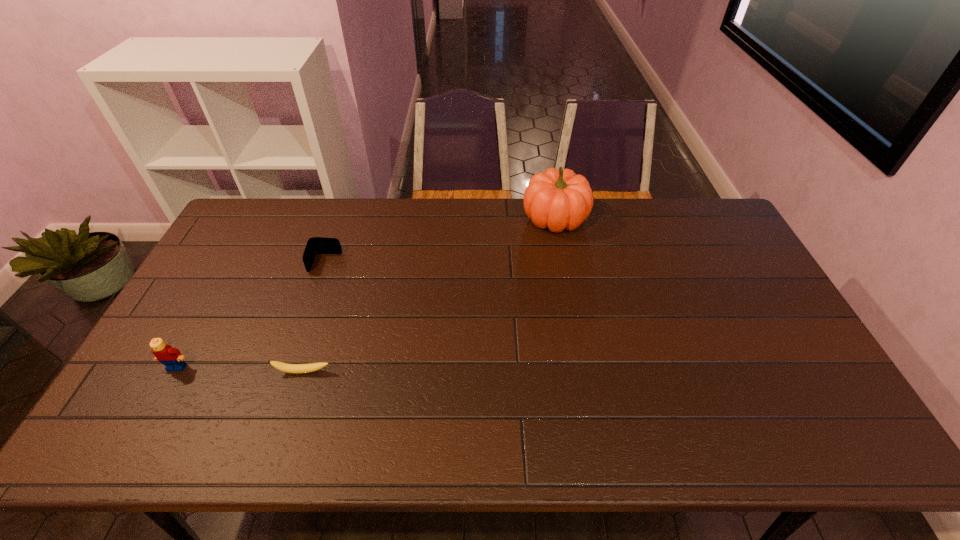
Locate an element on the screen. The image size is (960, 540). vacant space located on the upward curve of the shortest object is located at coordinates (285, 427).

Where is `object that is at the far edge`? object that is at the far edge is located at coordinates (559, 200).

Identify the location of object present at the left edge. The height and width of the screenshot is (540, 960). (171, 357).

You are a GUI agent. You are given a task and a screenshot of the screen. Output one action in this format:
    pyautogui.click(x=<x>, y=<y>)
    Task: Click on the vacant area at the far edge
    
    Given the screenshot: What is the action you would take?
    [x=420, y=231]

Where is `free region at the near edge of the desktop`? The image size is (960, 540). free region at the near edge of the desktop is located at coordinates (469, 432).

The image size is (960, 540). In the image, there is a desktop. Find the location of `free space at the left edge`. free space at the left edge is located at coordinates (164, 411).

Where is `vacant space at the right edge`? This screenshot has width=960, height=540. vacant space at the right edge is located at coordinates (798, 379).

Identify the location of vacant space in between the wallet and the farthest object. (440, 241).

Identify the location of free space that is in between the pumpkin and the banana. The height and width of the screenshot is (540, 960). (429, 295).

What are the coordinates of `free space between the shortest object and the pumpkin` in the screenshot? It's located at (429, 295).